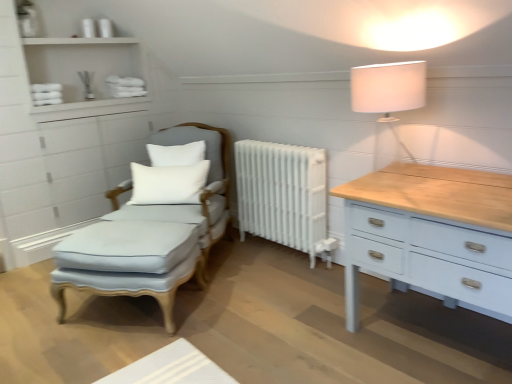
Where is `light blue fabric swivel chair at center-left`? light blue fabric swivel chair at center-left is located at coordinates (199, 192).

Find the location of a particular element. white painted radiator at center is located at coordinates (283, 195).

In order to click on light blue fabric footrest at center in this screenshot , I will do `click(129, 262)`.

I want to click on white matte shelves at upper left, so click(x=83, y=67).

This screenshot has height=384, width=512. Describe the element at coordinates (168, 183) in the screenshot. I see `white soft cushion at center, which is the first pillow in bottom-to-top order` at that location.

The width and height of the screenshot is (512, 384). I want to click on light blue fabric swivel chair at center-left, so click(x=199, y=192).

Locate an element on the screen. The width and height of the screenshot is (512, 384). shelf behind the light blue fabric swivel chair at center-left is located at coordinates (83, 67).

Is light blue fabric swivel chair at center-left to the left of white matte shelves at upper left from the viewer's perspective?

No, light blue fabric swivel chair at center-left is not to the left of white matte shelves at upper left.

Could you tell me if light blue fabric swivel chair at center-left is facing white matte shelves at upper left?

No.

From the image's perspective, between light blue fabric swivel chair at center-left and white matte shelves at upper left, which one is located above?

white matte shelves at upper left is shown above in the image.

Does white soft cushion at center, positioned as the second pillow in top-to-bottom order, appear on the right side of white matte shelves at upper left?

Yes, white soft cushion at center, positioned as the second pillow in top-to-bottom order, is to the right of white matte shelves at upper left.

Considering the sizes of objects white soft cushion at center, which is the first pillow in bottom-to-top order, and white matte shelves at upper left in the image provided, who is shorter, white soft cushion at center, which is the first pillow in bottom-to-top order, or white matte shelves at upper left?

white soft cushion at center, which is the first pillow in bottom-to-top order, is shorter.

Starting from the white matte shelves at upper left, which pillow is the 1st one to the right? Please provide its 2D coordinates.

[(168, 183)]

Considering the sizes of white soft cushion at center, which is the first pillow in bottom-to-top order, and white matte shelves at upper left in the image, is white soft cushion at center, which is the first pillow in bottom-to-top order, bigger or smaller than white matte shelves at upper left?

white soft cushion at center, which is the first pillow in bottom-to-top order, is smaller than white matte shelves at upper left.

From a real-world perspective, relative to light blue fabric footrest at center, is white matte shelves at upper left vertically above or below?

In terms of real-world spatial position, white matte shelves at upper left is above light blue fabric footrest at center.

Considering the relative positions of white matte shelves at upper left and light blue fabric footrest at center in the image provided, is white matte shelves at upper left behind light blue fabric footrest at center?

Yes, it is.

From the image's perspective, between white matte shelves at upper left and light blue fabric footrest at center, which one is located above?

white matte shelves at upper left, from the image's perspective.

How different are the orientations of white matte shelves at upper left and light blue fabric footrest at center in degrees?

The facing directions of white matte shelves at upper left and light blue fabric footrest at center are 57.4 degrees apart.

From the image's perspective, which is below, light blue fabric footrest at center or white fabric lampshade at upper right?

light blue fabric footrest at center, from the image's perspective.

Are light blue fabric footrest at center and white fabric lampshade at upper right making contact?

No, light blue fabric footrest at center is not touching white fabric lampshade at upper right.

From a real-world perspective, is light blue fabric footrest at center physically above white fabric lampshade at upper right?

Actually, light blue fabric footrest at center is physically below white fabric lampshade at upper right in the real world.

Is light blue fabric footrest at center completely or partially outside of white fabric lampshade at upper right?

Yes, light blue fabric footrest at center is outside of white fabric lampshade at upper right.

Based on the photo, is white matte pillow at center, the 1th pillow when ordered from top to bottom, to the left or to the right of light blue fabric footrest at center in the image?

white matte pillow at center, the 1th pillow when ordered from top to bottom, is positioned on light blue fabric footrest at center's right side.

From the image's perspective, would you say white matte pillow at center, the 1th pillow when ordered from top to bottom, is positioned over light blue fabric footrest at center?

Yes, from the image's perspective, white matte pillow at center, the 1th pillow when ordered from top to bottom, is over light blue fabric footrest at center.

Considering the sizes of objects white matte pillow at center, positioned as the 2th pillow in bottom-to-top order, and light blue fabric footrest at center in the image provided, who is smaller, white matte pillow at center, positioned as the 2th pillow in bottom-to-top order, or light blue fabric footrest at center?

Smaller between the two is white matte pillow at center, positioned as the 2th pillow in bottom-to-top order.

Which object is closer to the camera, white matte pillow at center, the 1th pillow when ordered from top to bottom, or light blue fabric footrest at center?

light blue fabric footrest at center is closer to the camera.

In terms of width, does white matte pillow at center, positioned as the 2th pillow in bottom-to-top order, look wider or thinner when compared to white matte shelves at upper left?

Considering their sizes, white matte pillow at center, positioned as the 2th pillow in bottom-to-top order, looks slimmer than white matte shelves at upper left.

Between white matte pillow at center, positioned as the 2th pillow in bottom-to-top order, and white matte shelves at upper left, which one is positioned behind?

white matte pillow at center, positioned as the 2th pillow in bottom-to-top order, is behind.

Which is farther, (157, 152) or (136, 102)?

Positioned behind is point (136, 102).

Is light blue fabric swivel chair at center-left inside the boundaries of white fabric lampshade at upper right, or outside?

light blue fabric swivel chair at center-left is spatially situated outside white fabric lampshade at upper right.

From the image's perspective, is light blue fabric swivel chair at center-left located beneath white fabric lampshade at upper right?

Yes, from the image's perspective, light blue fabric swivel chair at center-left is beneath white fabric lampshade at upper right.

From a real-world perspective, is light blue fabric swivel chair at center-left positioned under white fabric lampshade at upper right based on gravity?

Yes.

Between light blue fabric swivel chair at center-left and white fabric lampshade at upper right, which one has larger width?

light blue fabric swivel chair at center-left is wider.

You are a GUI agent. You are given a task and a screenshot of the screen. Output one action in this format:
    pyautogui.click(x=<x>, y=<y>)
    Task: Click on the shelf on the left of light blue fabric swivel chair at center-left
    This screenshot has width=512, height=384.
    Given the screenshot: What is the action you would take?
    pyautogui.click(x=83, y=67)

You are a GUI agent. You are given a task and a screenshot of the screen. Output one action in this format:
    pyautogui.click(x=<x>, y=<y>)
    Task: Click on the shelf behind the white soft cushion at center, which is the first pillow in bottom-to-top order
    
    Given the screenshot: What is the action you would take?
    pyautogui.click(x=83, y=67)

Considering their positions, is white soft cushion at center, which is the first pillow in bottom-to-top order, positioned further to white fabric lampshade at upper right than light blue fabric swivel chair at center-left?

white soft cushion at center, which is the first pillow in bottom-to-top order, is positioned further to the anchor white fabric lampshade at upper right.

Consider the image. Considering their positions, is white painted radiator at center positioned closer to white matte pillow at center, positioned as the 2th pillow in bottom-to-top order, than white matte shelves at upper left?

white painted radiator at center is positioned closer to the anchor white matte pillow at center, positioned as the 2th pillow in bottom-to-top order.

Estimate the real-world distances between objects in this image. Which object is closer to white fabric lampshade at upper right, white soft cushion at center, which is the first pillow in bottom-to-top order, or white matte pillow at center, positioned as the 2th pillow in bottom-to-top order?

white soft cushion at center, which is the first pillow in bottom-to-top order, is closer to white fabric lampshade at upper right.

From the image, which object appears to be farther from white matte pillow at center, the 1th pillow when ordered from top to bottom, white matte shelves at upper left or white soft cushion at center, which is the first pillow in bottom-to-top order?

white matte shelves at upper left is positioned further to the anchor white matte pillow at center, the 1th pillow when ordered from top to bottom.

Which object lies nearer to the anchor point light blue fabric footrest at center, white soft cushion at center, which is the first pillow in bottom-to-top order, or white painted radiator at center?

white soft cushion at center, which is the first pillow in bottom-to-top order, is closer to light blue fabric footrest at center.

Estimate the real-world distances between objects in this image. Which object is closer to light blue fabric footrest at center, white matte pillow at center, positioned as the 2th pillow in bottom-to-top order, or light blue fabric swivel chair at center-left?

light blue fabric swivel chair at center-left is positioned closer to the anchor light blue fabric footrest at center.

When comparing their distances from white soft cushion at center, which is the first pillow in bottom-to-top order, does white fabric lampshade at upper right or light blue fabric swivel chair at center-left seem further?

The object further to white soft cushion at center, which is the first pillow in bottom-to-top order, is white fabric lampshade at upper right.

Estimate the real-world distances between objects in this image. Which object is closer to light blue fabric footrest at center, white fabric lampshade at upper right or light blue fabric swivel chair at center-left?

light blue fabric swivel chair at center-left.

Locate an element on the screen. Image resolution: width=512 pixels, height=384 pixels. radiator located between white matte pillow at center, the 1th pillow when ordered from top to bottom, and white fabric lampshade at upper right in the left-right direction is located at coordinates (283, 195).

Image resolution: width=512 pixels, height=384 pixels. I want to click on swivel chair between light blue fabric footrest at center and white soft cushion at center, positioned as the second pillow in top-to-bottom order, from front to back, so click(199, 192).

Identify the location of radiator between white matte shelves at upper left and white fabric lampshade at upper right. The width and height of the screenshot is (512, 384). (283, 195).

You are a GUI agent. You are given a task and a screenshot of the screen. Output one action in this format:
    pyautogui.click(x=<x>, y=<y>)
    Task: Click on the swivel chair between white soft cushion at center, which is the first pillow in bottom-to-top order, and white painted radiator at center, in the horizontal direction
    Image resolution: width=512 pixels, height=384 pixels.
    Given the screenshot: What is the action you would take?
    pyautogui.click(x=199, y=192)